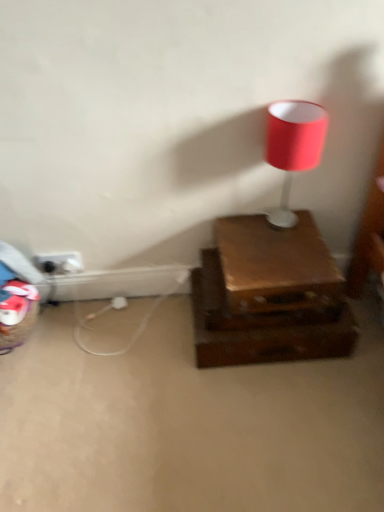
Where is `free space in front of matte red lampshade at upper right`? This screenshot has width=384, height=512. free space in front of matte red lampshade at upper right is located at coordinates (284, 258).